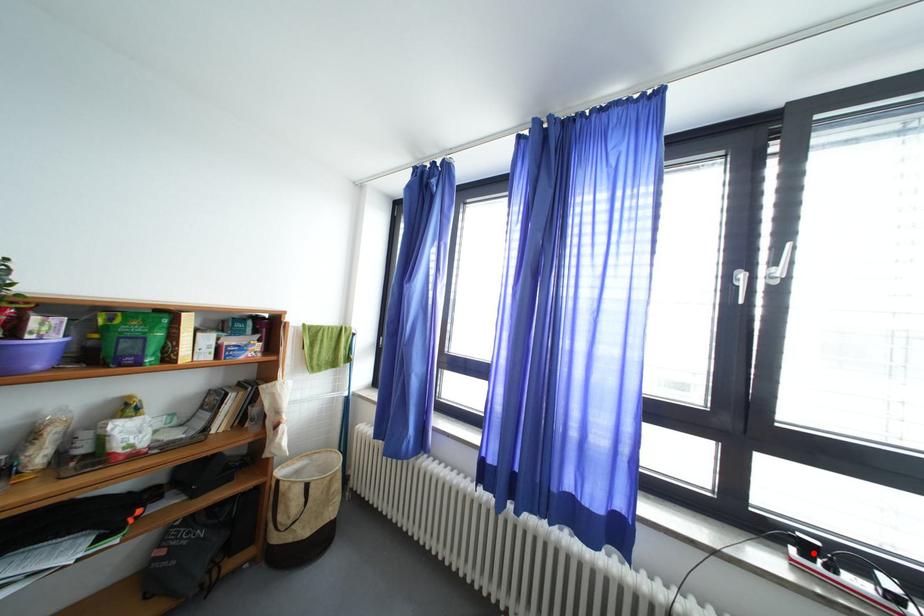
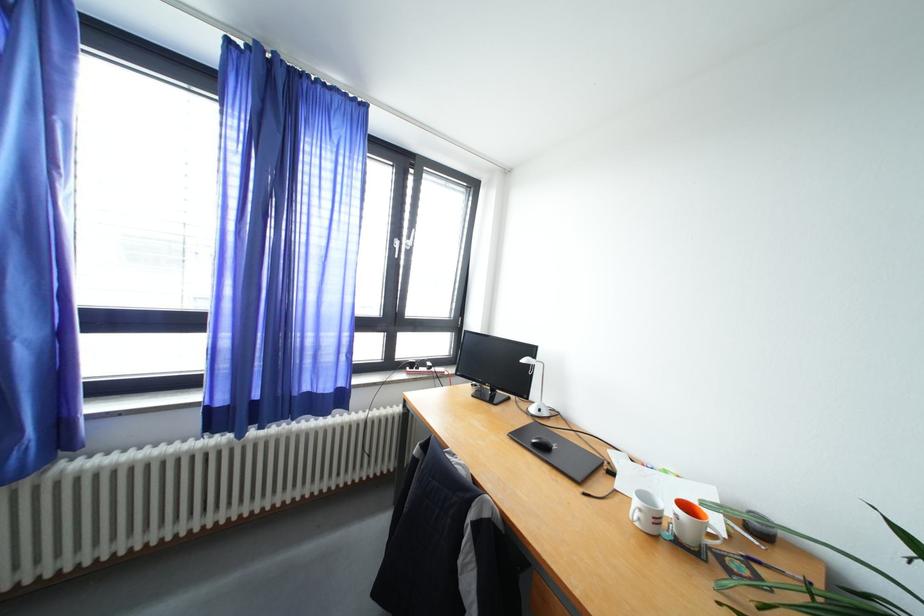
Question: I am providing you with two images of the same scene from different viewpoints. Given a red point in image1, look at the same physical point in image2. Is it:

Choices:
 (A) Closer to the viewpoint
 (B) Farther from the viewpoint

Answer: (B)